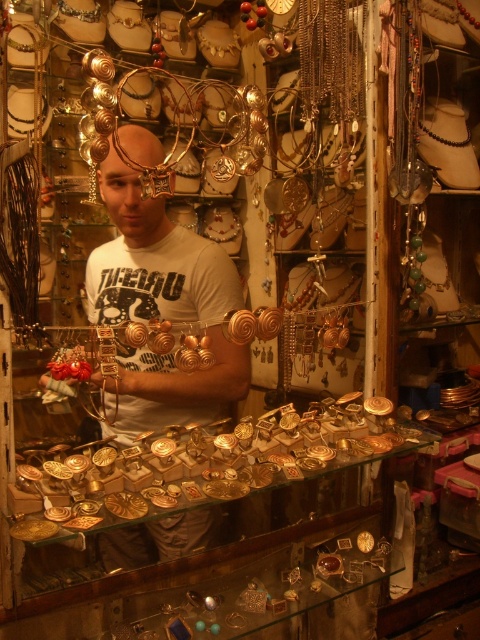
Question: Is gold shiny belt buckle at center to the right of white matte t-shirt at center from the viewer's perspective?

Choices:
 (A) no
 (B) yes

Answer: (B)

Question: Does gold shiny belt buckle at center have a larger size compared to white matte t-shirt at center?

Choices:
 (A) yes
 (B) no

Answer: (A)

Question: Does gold shiny belt buckle at center appear on the right side of white matte t-shirt at center?

Choices:
 (A) yes
 (B) no

Answer: (A)

Question: Which point is farther from the camera taking this photo?

Choices:
 (A) (192, 412)
 (B) (391, 424)

Answer: (B)

Question: Among these points, which one is farthest from the camera?

Choices:
 (A) (164, 438)
 (B) (204, 307)

Answer: (B)